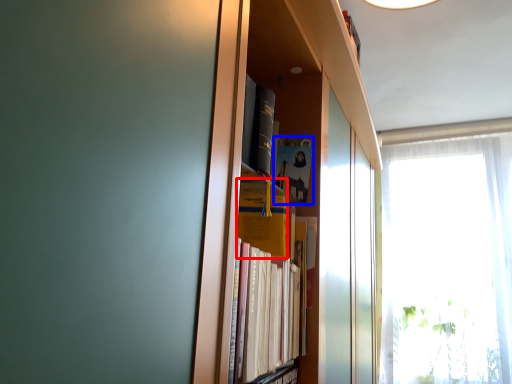
Question: Which point is closer to the camera, paperback book (highlighted by a red box) or paperback book (highlighted by a blue box)?

Choices:
 (A) paperback book
 (B) paperback book

Answer: (A)